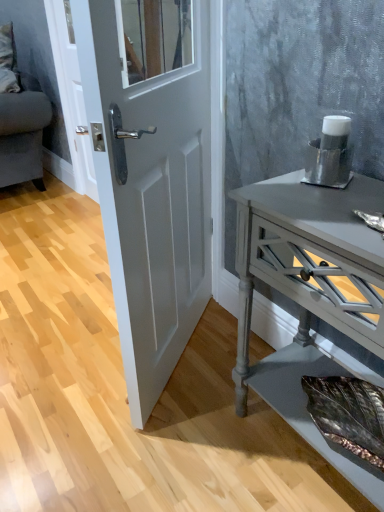
You are a GUI agent. You are given a task and a screenshot of the screen. Output one action in this format:
    pyautogui.click(x=<x>, y=<y>)
    Task: Click on the vacant space in front of white glossy door at center
    This screenshot has height=512, width=384.
    Given the screenshot: What is the action you would take?
    (x=158, y=434)